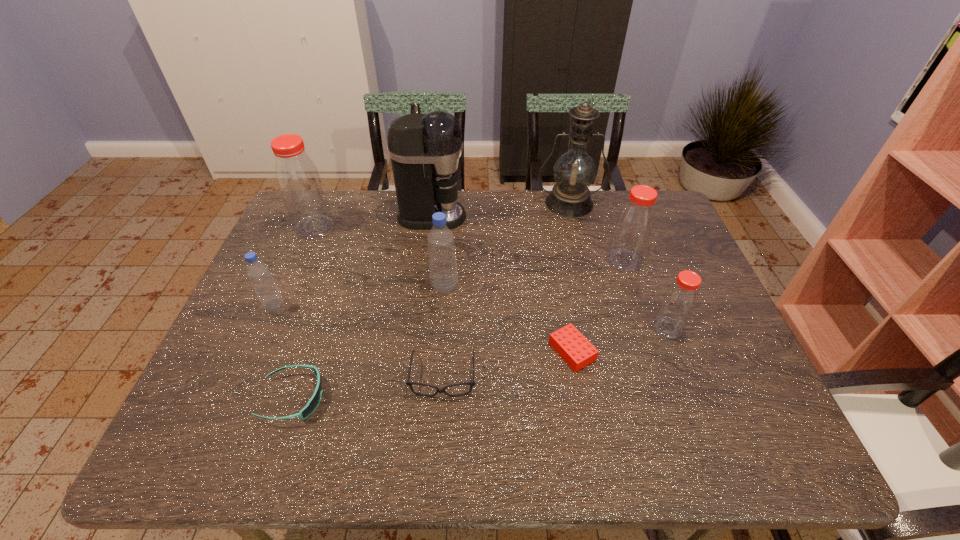
Where is `the sixth farthest object`? the sixth farthest object is located at coordinates (258, 272).

You are a GUI agent. You are given a task and a screenshot of the screen. Output one action in this format:
    pyautogui.click(x=<x>, y=<y>)
    Task: Click on the smaller blue bottle
    This screenshot has height=540, width=960.
    Given the screenshot: What is the action you would take?
    pyautogui.click(x=258, y=272)

The height and width of the screenshot is (540, 960). In order to click on spectacles in this screenshot , I will do `click(408, 383)`.

Find the location of `cyan sunglasses`. cyan sunglasses is located at coordinates (313, 403).

This screenshot has width=960, height=540. What are the coordinates of `the shortest object` in the screenshot? It's located at (568, 342).

The width and height of the screenshot is (960, 540). Identify the location of blank area located 0.170m on the front of the oil lamp. (581, 252).

You are a GUI agent. You are given a task and a screenshot of the screen. Output one action in this format:
    pyautogui.click(x=<x>, y=<y>)
    Task: Click on the vacant area situated 0.390m place cup under the spout of the coffee maker
    The image size is (960, 540).
    Given the screenshot: What is the action you would take?
    pyautogui.click(x=586, y=217)

This screenshot has height=540, width=960. What are the coordinates of `vacant space situated 0.060m on the right of the farthest red bottle` in the screenshot? It's located at (353, 228).

Locate an element on the screen. This screenshot has width=960, height=540. vacant space situated 0.400m on the front of the third bottle from left to right is located at coordinates (433, 437).

Image resolution: width=960 pixels, height=540 pixels. I want to click on vacant area situated 0.160m on the front of the second nearest red bottle, so click(x=642, y=316).